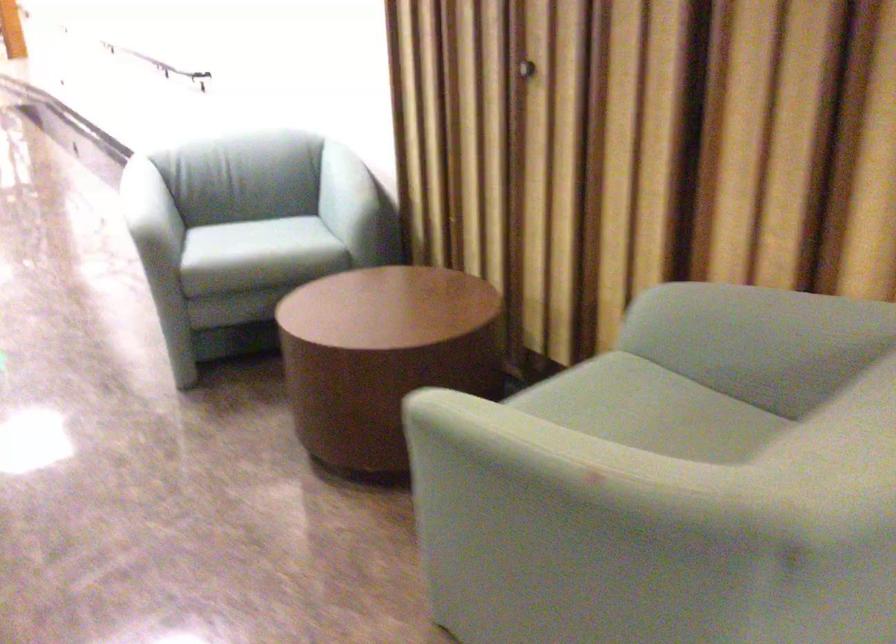
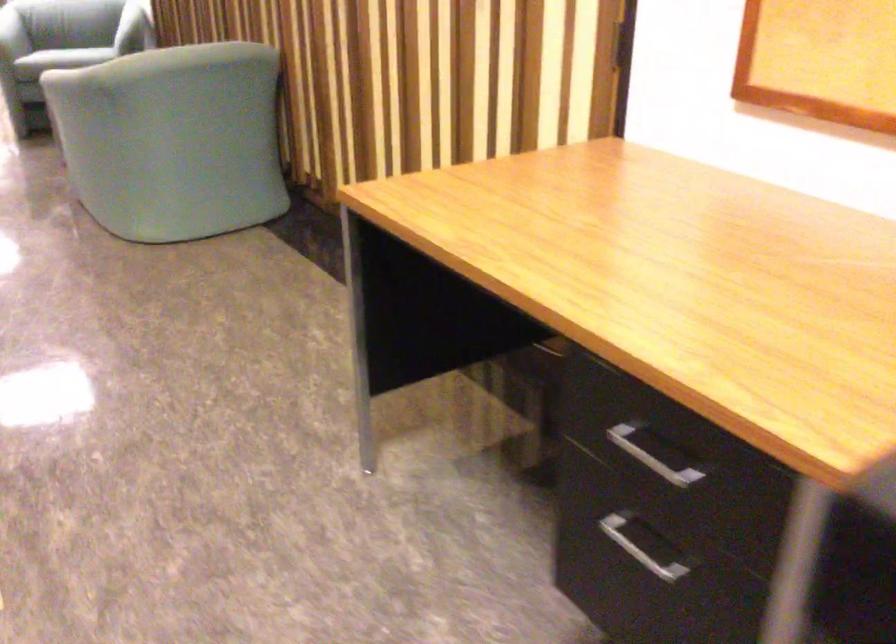
The point at (332, 294) is marked in the first image. Where is the corresponding point in the second image?

(66, 57)